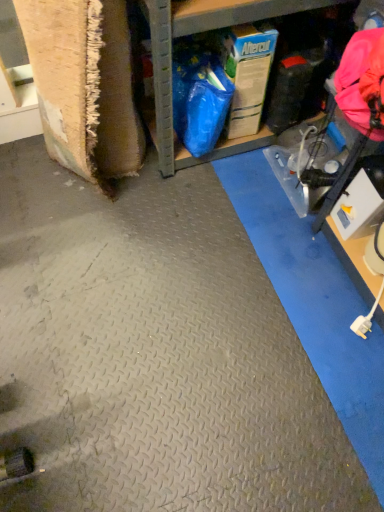
The height and width of the screenshot is (512, 384). Find the location of `cardboard box at upper right`. cardboard box at upper right is located at coordinates (171, 61).

Describe the element at coordinates (171, 61) in the screenshot. I see `cardboard box at upper right` at that location.

Identify the location of cardboard box at upper right. This screenshot has width=384, height=512. (171, 61).